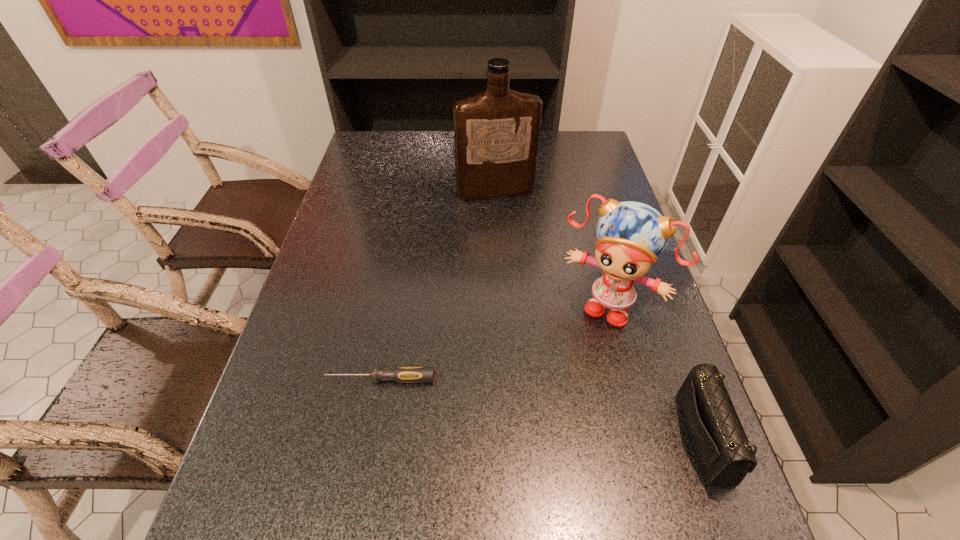
At what (x,y) coordinates should I click in order to perform the action: click on vacant area in the image that satisfies the following two spatial constraints: 1. on the front side of the doll; 2. on the front flap of the second shortest object. Please return your answer as a coordinate pair (x, y). Looking at the image, I should click on (645, 438).

You are a GUI agent. You are given a task and a screenshot of the screen. Output one action in this format:
    pyautogui.click(x=<x>, y=<y>)
    Task: Click on the vacant space that satisfies the following two spatial constraints: 1. on the front side of the third tallest object; 2. on the front flap of the doll
    This screenshot has width=960, height=540.
    Given the screenshot: What is the action you would take?
    pyautogui.click(x=645, y=438)

I want to click on vacant area in the image that satisfies the following two spatial constraints: 1. on the front side of the doll; 2. on the front flap of the nearest object, so click(645, 438).

The height and width of the screenshot is (540, 960). I want to click on free space in the image that satisfies the following two spatial constraints: 1. on the front side of the third tallest object; 2. on the front flap of the liquor, so click(x=506, y=438).

Identify the location of free point that satisfies the following two spatial constraints: 1. on the front side of the liquor; 2. on the front flap of the third tallest object. pyautogui.click(x=506, y=438).